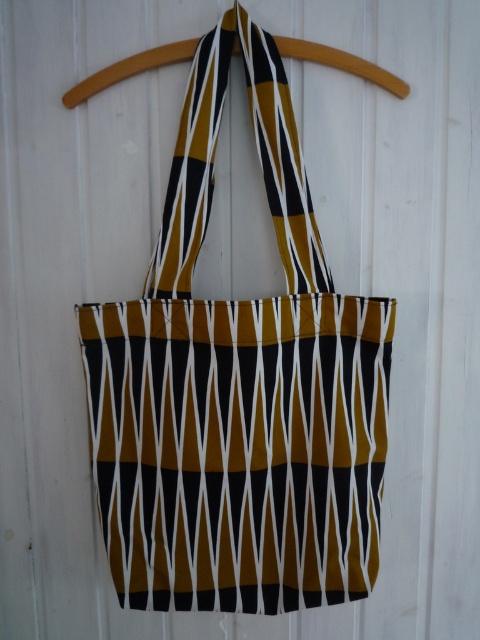
Which is more to the left, mustard and black striped tote at center or wooden hanger at center?

From the viewer's perspective, wooden hanger at center appears more on the left side.

Can you confirm if mustard and black striped tote at center is bigger than wooden hanger at center?

Yes, mustard and black striped tote at center is bigger than wooden hanger at center.

Does point (307, 340) come closer to viewer compared to point (88, 77)?

Yes, point (307, 340) is in front of point (88, 77).

You are a GUI agent. You are given a task and a screenshot of the screen. Output one action in this format:
    pyautogui.click(x=<x>, y=<y>)
    Task: Click on the mustard and black striped tote at center
    The height and width of the screenshot is (640, 480).
    Given the screenshot: What is the action you would take?
    pyautogui.click(x=239, y=388)